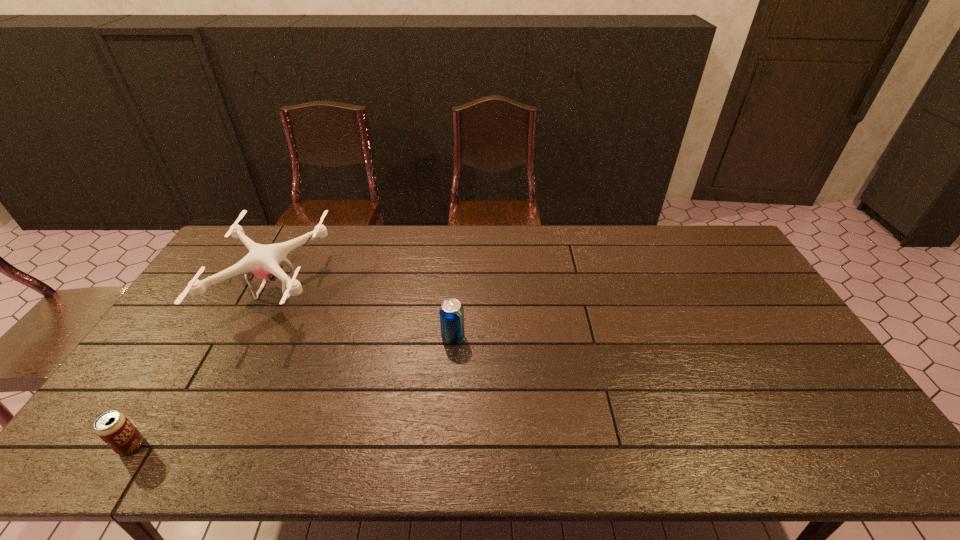
Select which object is the second closest to the rightmost object. Please provide its 2D coordinates. Your answer should be formatted as a tuple, i.e. [(x, y)], where the tuple contains the x and y coordinates of a point satisfying the conditions above.

[(114, 428)]

Identify the location of free location that satisfies the following two spatial constraints: 1. on the back side of the right beer can; 2. on the top of the tallest object. The image size is (960, 540). (456, 289).

Identify the location of blank space that satisfies the following two spatial constraints: 1. on the top of the drone; 2. on the left side of the farther beer can. This screenshot has height=540, width=960. (252, 337).

The height and width of the screenshot is (540, 960). I want to click on vacant space that satisfies the following two spatial constraints: 1. on the top of the drone; 2. on the back side of the farther beer can, so click(252, 337).

You are a GUI agent. You are given a task and a screenshot of the screen. Output one action in this format:
    pyautogui.click(x=<x>, y=<y>)
    Task: Click on the blank space that satisfies the following two spatial constraints: 1. on the back side of the rightmost object; 2. on the top of the drone
    This screenshot has height=540, width=960.
    Given the screenshot: What is the action you would take?
    click(x=456, y=289)

At what (x,y) coordinates should I click in order to perform the action: click on free space that satisfies the following two spatial constraints: 1. on the back side of the taller beer can; 2. on the top of the tallest object. Please return your answer as a coordinate pair (x, y). Looking at the image, I should click on (456, 289).

This screenshot has height=540, width=960. Identify the location of blank space that satisfies the following two spatial constraints: 1. on the top of the drone; 2. on the back side of the rightmost object. (252, 337).

Where is `blank space that satisfies the following two spatial constraints: 1. on the top of the drone; 2. on the left side of the taller beer can`? blank space that satisfies the following two spatial constraints: 1. on the top of the drone; 2. on the left side of the taller beer can is located at coordinates (252, 337).